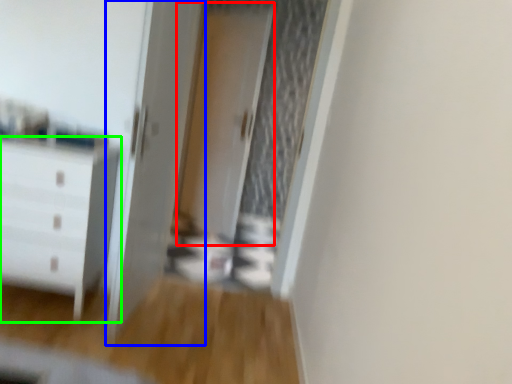
Question: Based on their relative distances, which object is farther from screen door (highlighted by a red box)? Choose from door (highlighted by a blue box) and chest of drawers (highlighted by a green box).

Choices:
 (A) door
 (B) chest of drawers

Answer: (B)